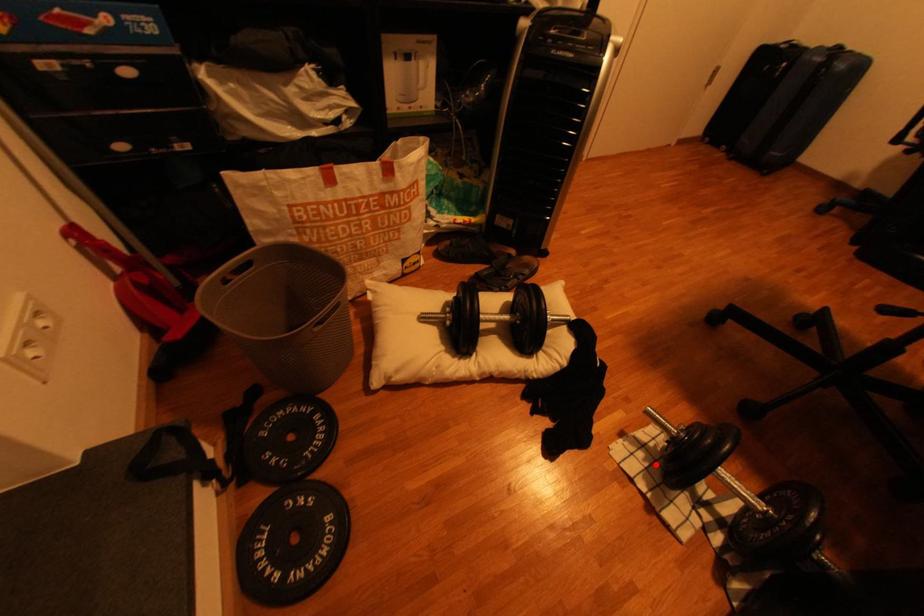
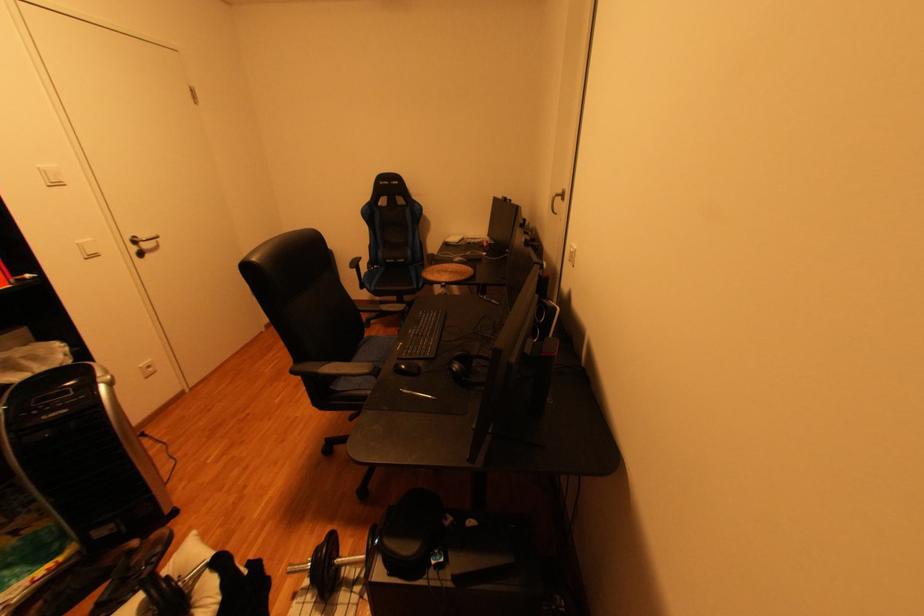
Question: I am providing you with two images of the same scene from different viewpoints. A red point is marked on the first image. At the location where the point appears in image 1, is it still visible in image 2?

Choices:
 (A) Yes
 (B) No

Answer: (A)